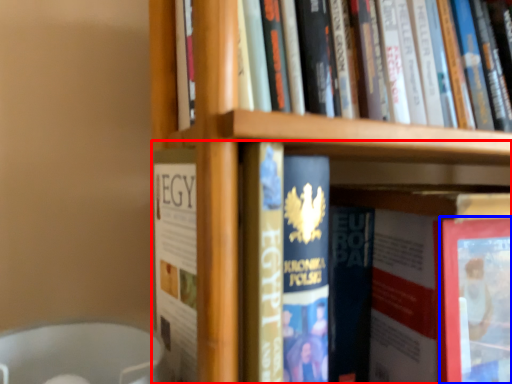
Question: Which object appears farthest to the camera in this image, book (highlighted by a red box) or paperback book (highlighted by a blue box)?

Choices:
 (A) book
 (B) paperback book

Answer: (B)